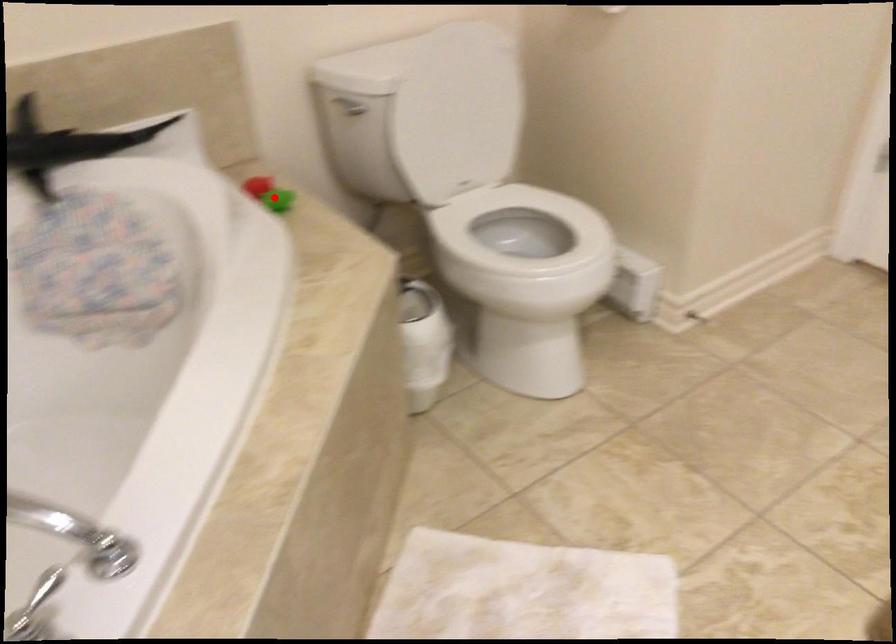
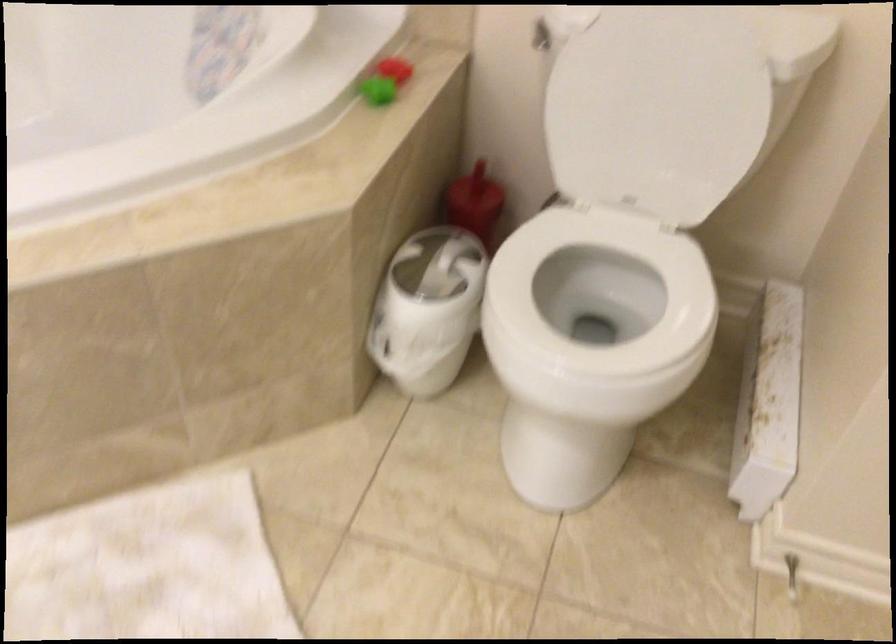
Question: I am providing you with two images of the same scene from different viewpoints. Image1 has a red point marked. In image2, the corresponding 3D location appears at what relative position? Reply with the corresponding letter.

Choices:
 (A) Closer
 (B) Farther

Answer: (A)